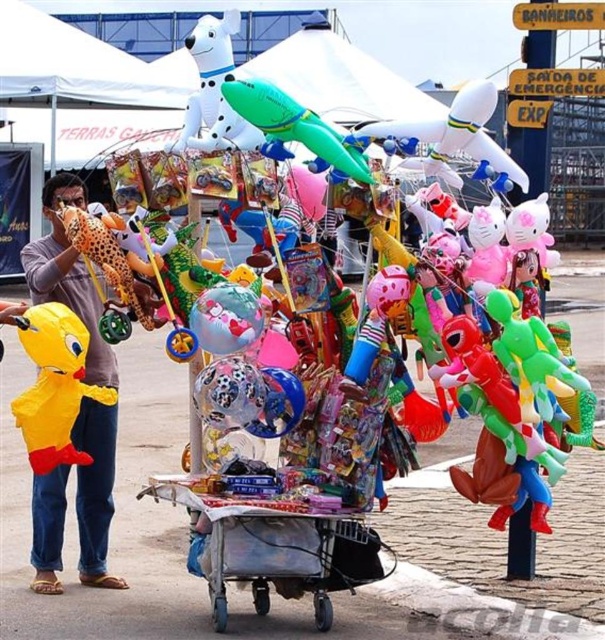
Question: Which of the following is the closest to the observer?

Choices:
 (A) (329, 621)
 (B) (70, 292)

Answer: (A)

Question: Estimate the real-world distances between objects in this image. Which object is closer to the green inflatable airplane at center?

Choices:
 (A) white glossy dog at upper center
 (B) yellow fabric toy at left
 (C) yellow matte rubber duck at left
 (D) metallic silver cart at center

Answer: (A)

Question: Does yellow fabric toy at left appear over yellow matte rubber duck at left?

Choices:
 (A) no
 (B) yes

Answer: (B)

Question: Is yellow matte rubber duck at left below green inflatable airplane at center?

Choices:
 (A) no
 (B) yes

Answer: (B)

Question: Among these objects, which one is nearest to the camera?

Choices:
 (A) yellow fabric toy at left
 (B) yellow matte rubber duck at left

Answer: (B)

Question: Is metallic silver cart at center thinner than green inflatable airplane at center?

Choices:
 (A) no
 (B) yes

Answer: (A)